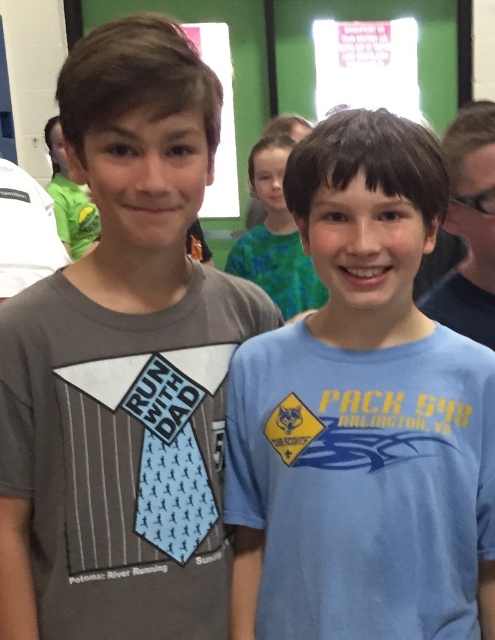
Question: Which point is closer to the camera?

Choices:
 (A) blue cotton shirt at center
 (B) gray cotton shirt at center
 (C) green matte shirt at center

Answer: (A)

Question: Which is nearer to the blue cotton shirt at center?

Choices:
 (A) gray cotton shirt at center
 (B) green matte shirt at center

Answer: (A)

Question: Is blue cotton shirt at center behind green matte shirt at center?

Choices:
 (A) no
 (B) yes

Answer: (A)

Question: Does gray cotton shirt at center come behind green matte shirt at center?

Choices:
 (A) no
 (B) yes

Answer: (A)

Question: Is blue cotton shirt at center positioned before green matte shirt at center?

Choices:
 (A) no
 (B) yes

Answer: (B)

Question: Which point is closer to the camera taking this photo?

Choices:
 (A) (276, 236)
 (B) (46, 545)

Answer: (B)